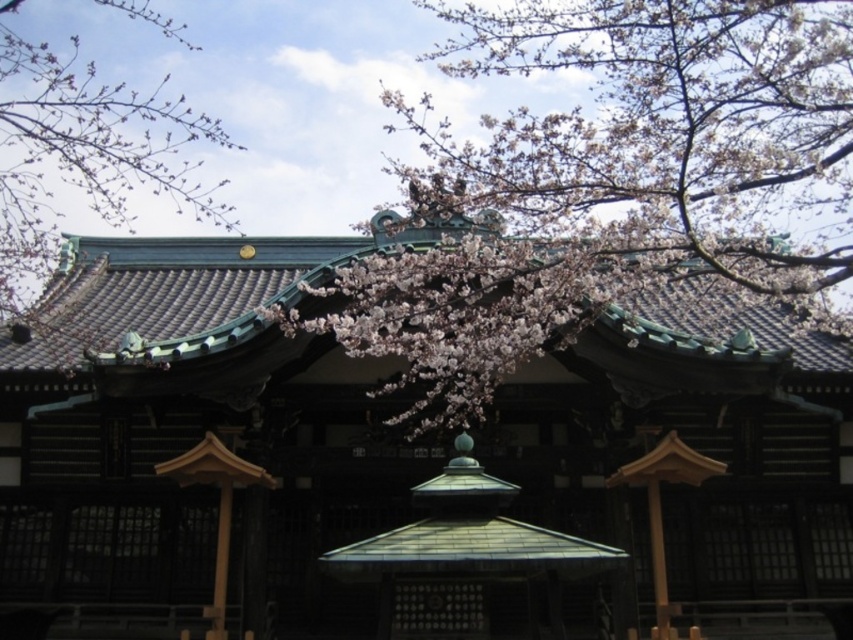
You are standing in front of the traditional Japanese building and want to take a photo that includes both the building and the cherry blossoms. Where should you position yourself to ensure the point at coordinates [605,184] falls within the frame?

The point at coordinates [605,184] is on the pink blossom at center. To include both the building and the cherry blossoms in your photo, position yourself so that the blossom at the center is within the frame, ensuring the point is included.

You are standing in front of the traditional Japanese building and want to take a photo of the pink blossom at center without any obstructions. Based on its position, can you determine if the blossom is positioned in a way that allows for an unobstructed view?

The pink blossom at center is located at point [605,184], which is within the central area of the image. Since the description mentions that the branches partially obscure the building but does not specify obstruction to the blossom itself, it is likely the blossom can be photographed without obstruction.